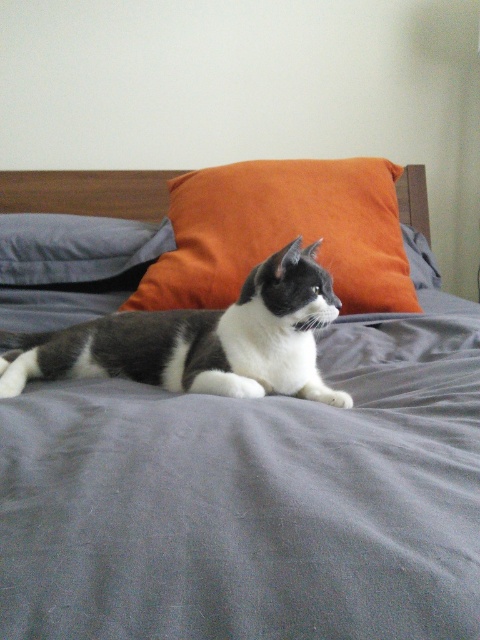
You are arranging a photo shoot and need to place a small camera on the bed. The camera must be positioned between the gray fabric bed at center and the matte gray pillow at left. Based on their positions, where should you place the camera?

The gray fabric bed at center is to the right of the matte gray pillow at left, so you should place the camera between them by positioning it to the right of the matte gray pillow at left and to the left of the gray fabric bed at center.